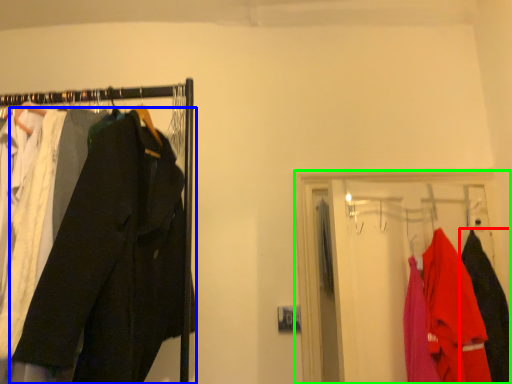
Question: Estimate the real-world distances between objects in this image. Which object is farther from clothing (highlighted by a red box), trousers (highlighted by a blue box) or closet (highlighted by a green box)?

Choices:
 (A) trousers
 (B) closet

Answer: (A)